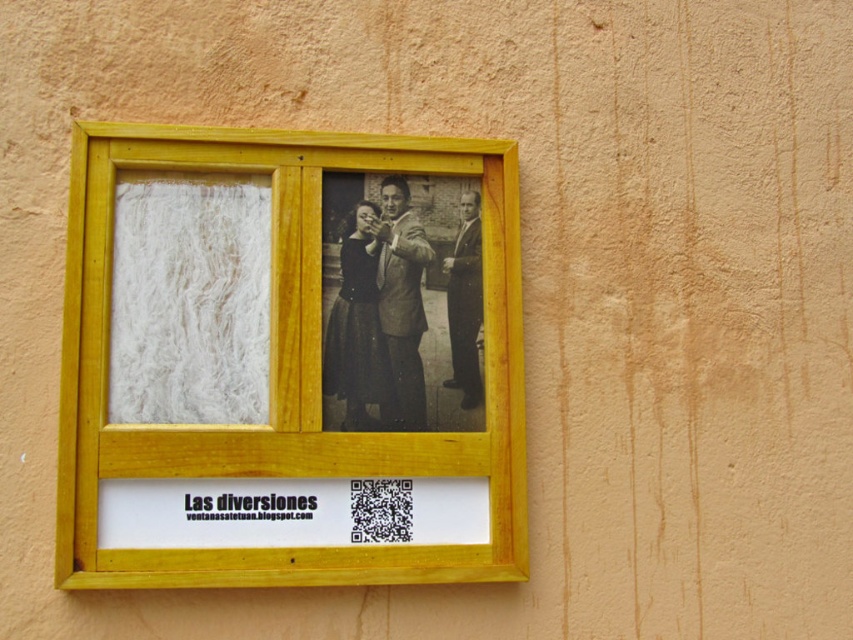
Question: Is yellow wood photo frame at upper left wider than black glossy suit at center?

Choices:
 (A) yes
 (B) no

Answer: (A)

Question: Where is yellow wood photo frame at upper left located in relation to black glossy suit at center in the image?

Choices:
 (A) left
 (B) right

Answer: (A)

Question: Does yellow wood photo frame at upper left lie in front of black glossy suit at center?

Choices:
 (A) no
 (B) yes

Answer: (B)

Question: Among these points, which one is nearest to the camera?

Choices:
 (A) (128, 145)
 (B) (384, 236)

Answer: (A)

Question: Which object is farther from the camera taking this photo?

Choices:
 (A) yellow wood photo frame at upper left
 (B) black glossy suit at center

Answer: (B)

Question: Which point is farther from the camera taking this photo?

Choices:
 (A) (94, 493)
 (B) (399, 205)

Answer: (B)